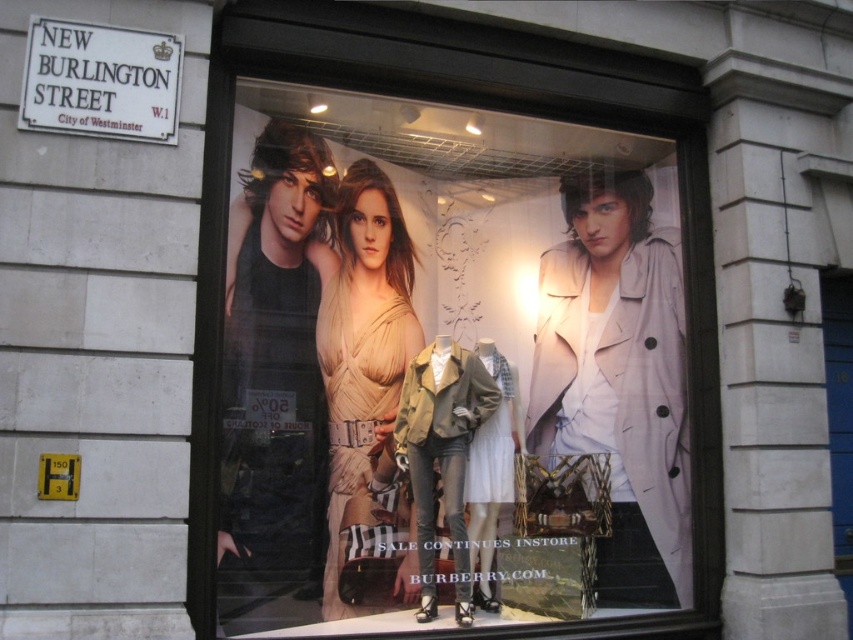
You are a delivery person trying to locate the address on the white stone street sign at upper left. However, you notice the matte beige dress at center is blocking your view. Which object is closer to you, the one you need to move to see the sign?

The matte beige dress at center is closer to you than the white stone street sign at upper left, so you need to move the matte beige dress at center to see the sign.

From the picture: You are a window designer who needs to ensure all items in the display are visible to passersby. Considering the size of the matte beige dress at center and the white stone street sign at upper left, which object might block the view of the other?

Result: The matte beige dress at center is bigger than the white stone street sign at upper left, so the dress could potentially block the view of the street sign if positioned in front of it.

You are a passerby standing on New Burlington Street. You see the matte beige dress at center and the white stone street sign at upper left in the store window. Which object is closer to you?

The matte beige dress at center is positioned under the white stone street sign at upper left, meaning the dress is closer to you since it is below the sign in the window display.